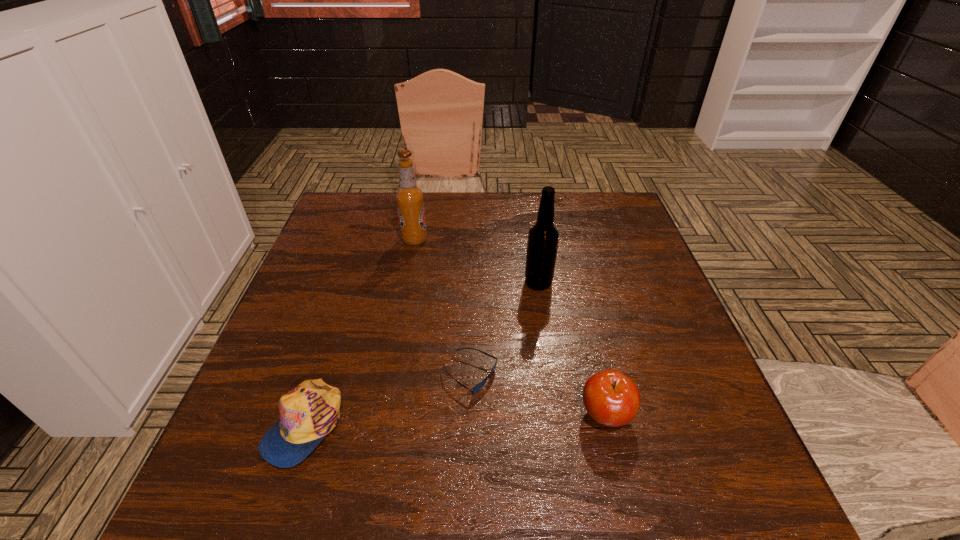
Find the location of a particular element. vacant space located 0.340m on the front of the second farthest object is located at coordinates (558, 416).

The width and height of the screenshot is (960, 540). In order to click on vacant space located on the front label of the left beer bottle in this screenshot , I will do `click(534, 240)`.

In order to click on vacant region located 0.170m on the right of the rightmost object in this screenshot , I will do `click(723, 415)`.

Where is `free space located 0.050m at the front of the shortest object showing the lenses`? The height and width of the screenshot is (540, 960). free space located 0.050m at the front of the shortest object showing the lenses is located at coordinates (522, 376).

Identify the location of object situated at the far edge. Image resolution: width=960 pixels, height=540 pixels. (409, 198).

The height and width of the screenshot is (540, 960). Identify the location of object positioned at the near edge. (310, 411).

At what (x,y) coordinates should I click in order to perform the action: click on object that is at the left edge. Please return your answer as a coordinate pair (x, y). The height and width of the screenshot is (540, 960). Looking at the image, I should click on (310, 411).

Locate an element on the screen. The height and width of the screenshot is (540, 960). object that is at the near left corner is located at coordinates (310, 411).

This screenshot has height=540, width=960. I want to click on free spot at the far edge of the desktop, so click(x=496, y=205).

The image size is (960, 540). Find the location of `vacant position at the left edge of the desktop`. vacant position at the left edge of the desktop is located at coordinates (344, 278).